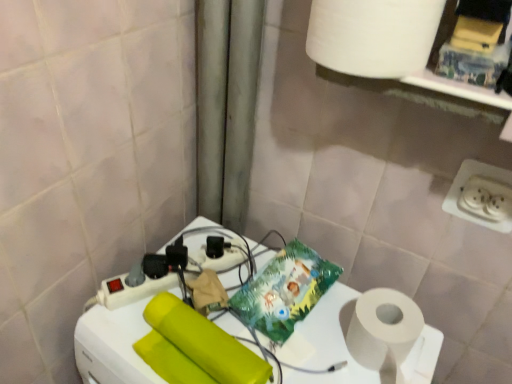
At what (x,y) coordinates should I click in order to perform the action: click on blank space above white plastic power strip at center (from a real-world perspective). Please return your answer as a coordinate pair (x, y). The width and height of the screenshot is (512, 384). Looking at the image, I should click on (265, 320).